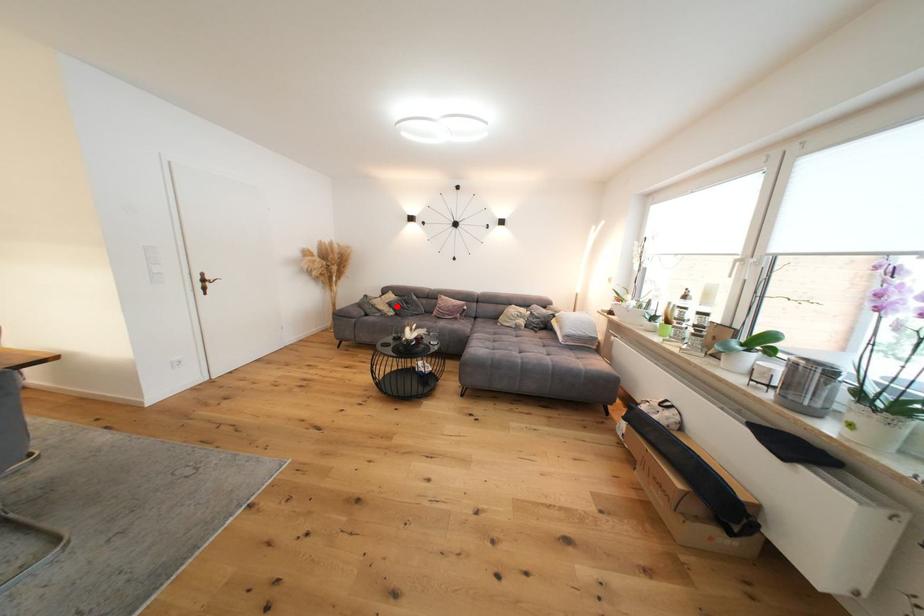
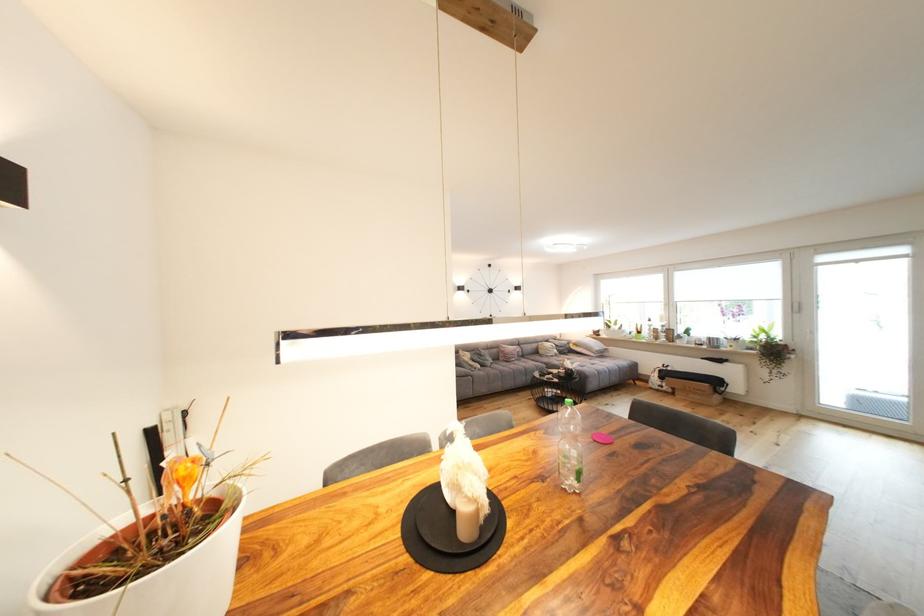
Question: I am providing you with two images of the same scene from different viewpoints. A red point is shown in image1. For the corresponding object point in image2, is it positioned nearer or farther from the camera?

Choices:
 (A) Nearer
 (B) Farther

Answer: (B)